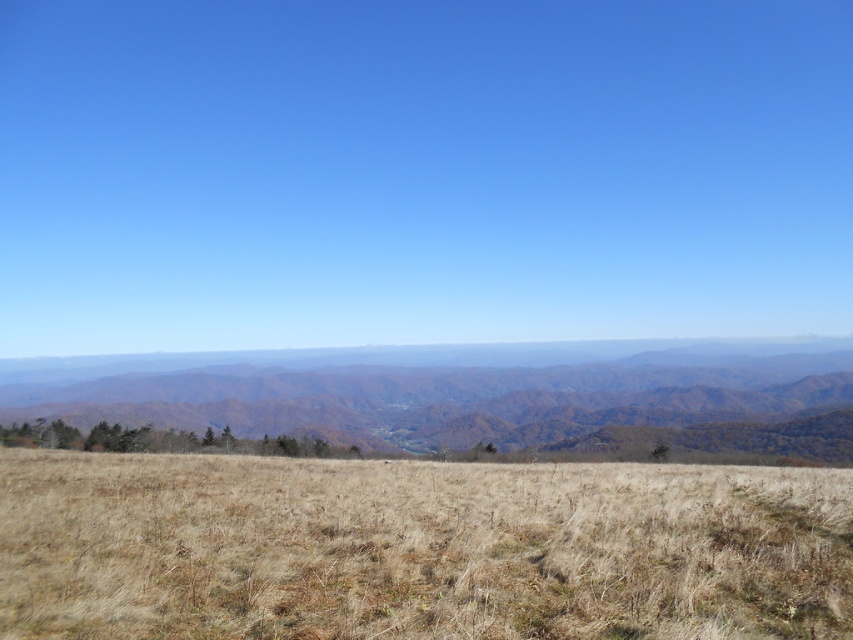
You are a hiker standing on the brown dry grass at center and want to reach the brown textured mountains at center. Based on the scene, which direction should you move to get closer to the mountains?

The brown dry grass at center is in front of the brown textured mountains at center, so to get closer to the mountains, you should move backward away from the brown dry grass at center.

You are standing at the origin point of the coordinate system in this landscape. You want to walk towards the brown dry grass at center. What direction should you head in?

The brown dry grass at center is located at coordinate point 0.858 on the x axis and 0.491 on the y axis. Since you are at the origin point, you should move towards the positive x and positive y direction to reach it.

You are a hiker trying to estimate distances in the landscape. Which object, the brown dry grass at center or the brown textured mountains at center, appears closer to you based on their size?

The brown dry grass at center appears closer because it has a smaller size compared to the brown textured mountains at center, which are farther away and thus appear smaller in the distance.